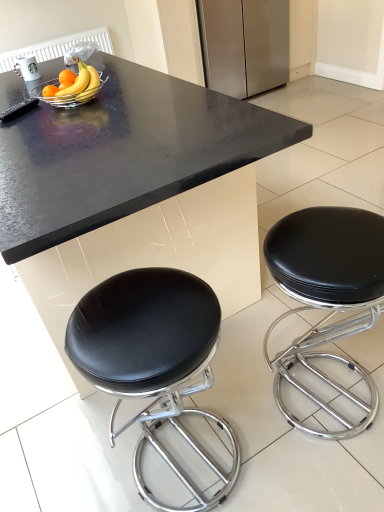
The height and width of the screenshot is (512, 384). I want to click on empty space that is ontop of metallic silver bowl at upper center (from a real-world perspective), so click(x=74, y=85).